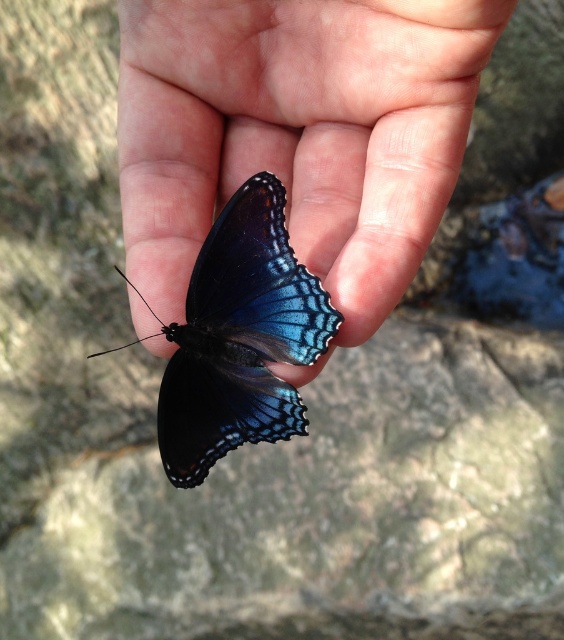
Question: Among these objects, which one is farthest from the camera?

Choices:
 (A) shiny blue butterfly at center
 (B) matte black butterfly at center

Answer: (A)

Question: Is matte black butterfly at center positioned in front of shiny blue butterfly at center?

Choices:
 (A) no
 (B) yes

Answer: (B)

Question: Which point is farther to the camera?

Choices:
 (A) (257, 196)
 (B) (413, 109)

Answer: (B)

Question: Does matte black butterfly at center have a smaller size compared to shiny blue butterfly at center?

Choices:
 (A) yes
 (B) no

Answer: (B)

Question: Is matte black butterfly at center to the left of shiny blue butterfly at center from the viewer's perspective?

Choices:
 (A) yes
 (B) no

Answer: (B)

Question: Among these points, which one is nearest to the camera?

Choices:
 (A) (231, 6)
 (B) (188, 445)

Answer: (B)